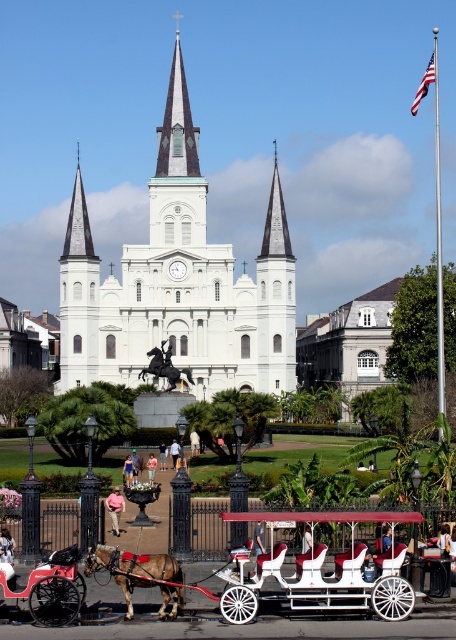
You are planning to take a photo of the white stone church at center and the shiny black horse at center. Which object should you focus on first if you want to capture both in a single frame without moving the camera?

You should focus on the white stone church at center first because it is wider than the shiny black horse at center, ensuring both fit within the frame.

You are a photographer planning to take a photo of the white stone church at center and the shiny black horse at center. Based on their sizes, which one should you focus on to ensure it fills the frame better?

The white stone church at center is bigger than the shiny black horse at center, so focusing on it will fill the frame better.

You are a photographer planning to take a photo of the brown glossy horse at lower left and the shiny black horse at center. Based on their heights, which horse should be placed closer to the camera to avoid one blocking the other?

The brown glossy horse at lower left is taller than the shiny black horse at center, so to avoid blocking, the shorter shiny black horse at center should be placed closer to the camera.